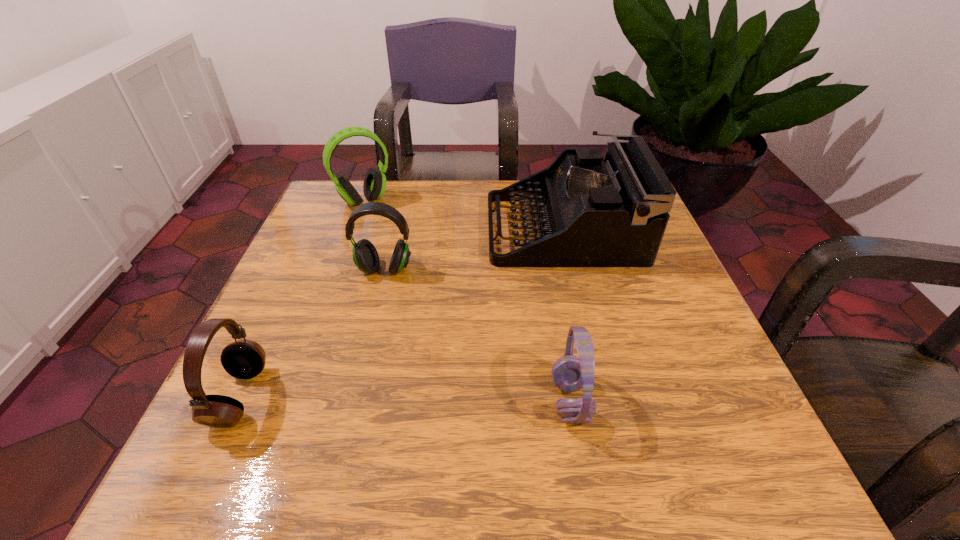
At what (x,y) coordinates should I click in order to perform the action: click on free space located on the headband and ear cups of the rightmost headset. Please return your answer as a coordinate pair (x, y). Looking at the image, I should click on click(495, 401).

In order to click on vacant space located on the headband and ear cups of the rightmost headset in this screenshot , I will do `click(396, 401)`.

What are the coordinates of `headset located at the far edge` in the screenshot? It's located at (374, 186).

At what (x,y) coordinates should I click in order to perform the action: click on typewriter that is at the far edge. Please return your answer as a coordinate pair (x, y). This screenshot has height=540, width=960. Looking at the image, I should click on (591, 212).

Where is `object that is at the right edge`? object that is at the right edge is located at coordinates (591, 212).

Identify the location of object that is at the far left corner. (374, 186).

In order to click on object present at the near left corner in this screenshot , I will do `click(244, 359)`.

Image resolution: width=960 pixels, height=540 pixels. Identify the location of object positioned at the far right corner. (591, 212).

Where is `free space at the far edge of the desktop`? free space at the far edge of the desktop is located at coordinates (389, 185).

In the image, there is a desktop. Identify the location of free region at the near edge. (372, 477).